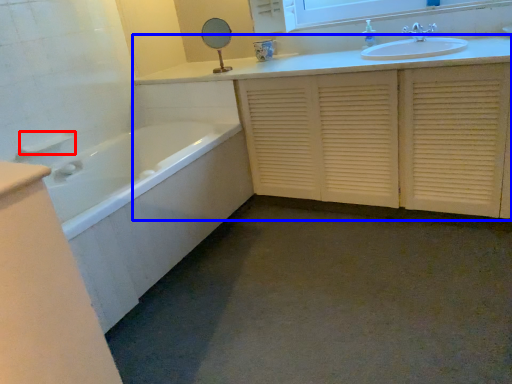
Question: Which object appears closest to the camera in this image, towel bar (highlighted by a red box) or bathroom cabinet (highlighted by a blue box)?

Choices:
 (A) towel bar
 (B) bathroom cabinet

Answer: (B)